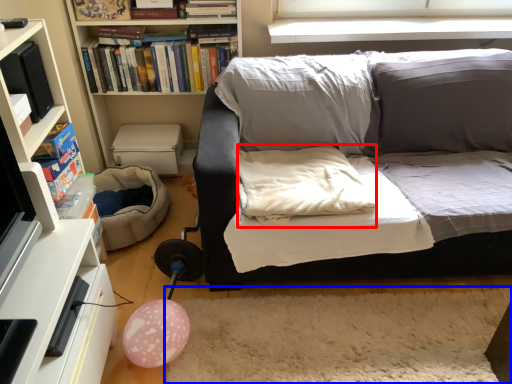
Question: Which point is further to the camera, pillow (highlighted by a red box) or plain (highlighted by a blue box)?

Choices:
 (A) pillow
 (B) plain

Answer: (A)